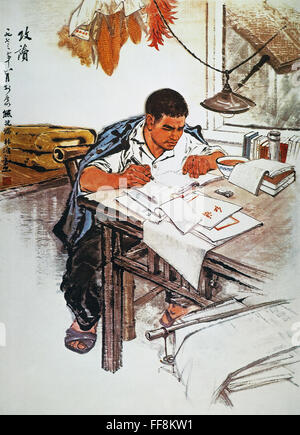
Locate an element on the screen. The image size is (300, 435). wooden table is located at coordinates (253, 245).